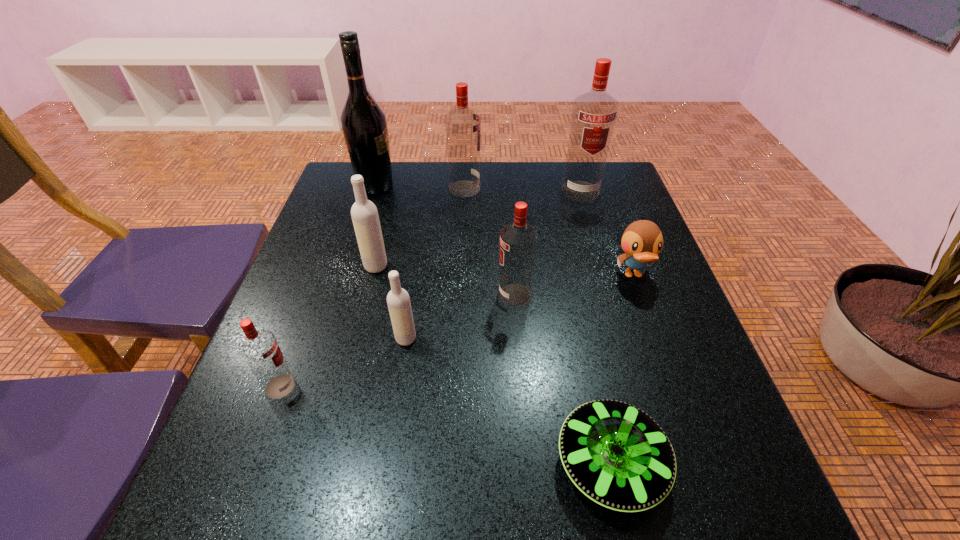
Where is `the second nearest object`? the second nearest object is located at coordinates (259, 348).

Locate an element on the screen. Image resolution: width=960 pixels, height=540 pixels. the third vodka from left to right is located at coordinates (398, 300).

Image resolution: width=960 pixels, height=540 pixels. In order to click on the smaller white vodka in this screenshot , I will do `click(398, 300)`.

Image resolution: width=960 pixels, height=540 pixels. I want to click on duck, so click(642, 241).

Locate an element on the screen. The image size is (960, 540). the second shortest object is located at coordinates (642, 241).

Image resolution: width=960 pixels, height=540 pixels. I want to click on saucer, so [x=617, y=455].

What are the coordinates of `green saucer` in the screenshot? It's located at (617, 455).

Locate an element on the screen. blank area located on the label of the wine bottle is located at coordinates (413, 186).

Find the location of a particular element. Image resolution: width=960 pixels, height=540 pixels. vacant region located on the front label of the rightmost vodka is located at coordinates (599, 254).

At what (x,y) coordinates should I click in order to perform the action: click on free space located 0.150m on the front label of the seventh shortest object. Please return your answer as a coordinate pair (x, y). Looking at the image, I should click on (533, 189).